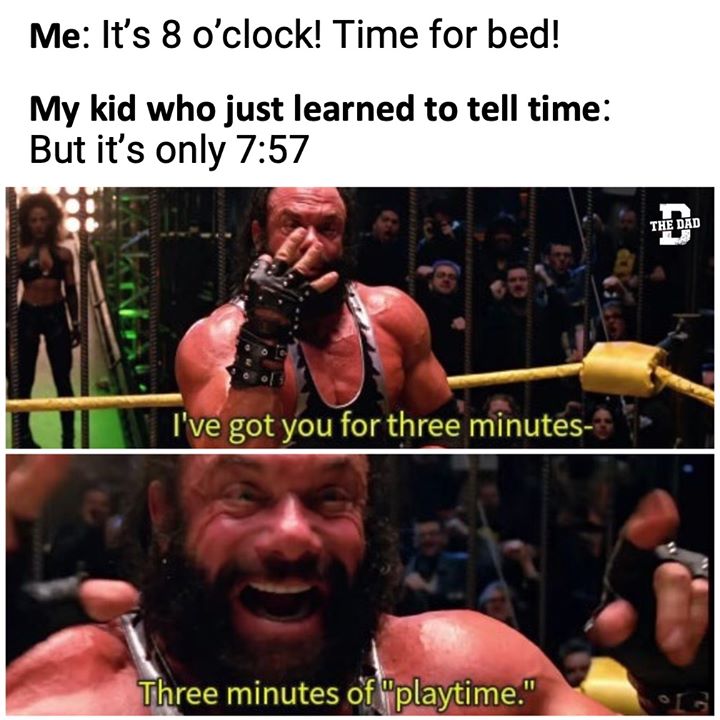
Locate an element on the screen. corridor is located at coordinates (96, 368).